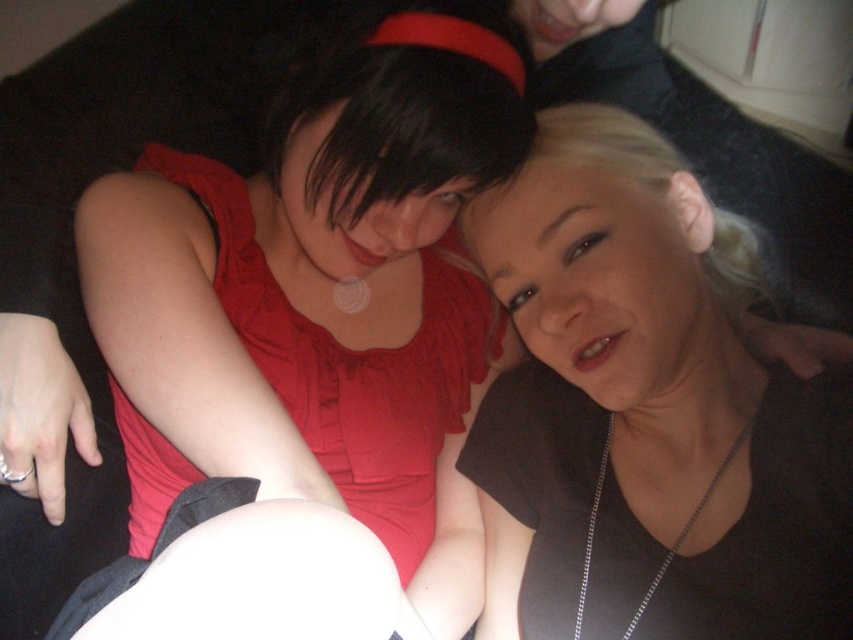
Does matte black shirt at center have a larger size compared to silver chain necklace at center?

Yes.

Does point (787, 628) come farther from viewer compared to point (666, 570)?

No, (787, 628) is in front of (666, 570).

Locate an element on the screen. The image size is (853, 640). matte black shirt at center is located at coordinates (646, 412).

Where is `matte black shirt at center`? matte black shirt at center is located at coordinates (646, 412).

Between matte red dress at center and silver chain necklace at center, which one has less height?

With less height is silver chain necklace at center.

Can you confirm if matte red dress at center is positioned to the left of silver chain necklace at center?

Indeed, matte red dress at center is positioned on the left side of silver chain necklace at center.

Which is behind, point (190, 200) or point (656, 572)?

Point (190, 200)

Find the location of a particular element. matte red dress at center is located at coordinates (x=306, y=355).

Does point (137, 544) lie in front of point (807, 499)?

No.

Describe the element at coordinates (306, 355) in the screenshot. The width and height of the screenshot is (853, 640). I see `matte red dress at center` at that location.

Locate an element on the screen. matte red dress at center is located at coordinates (306, 355).